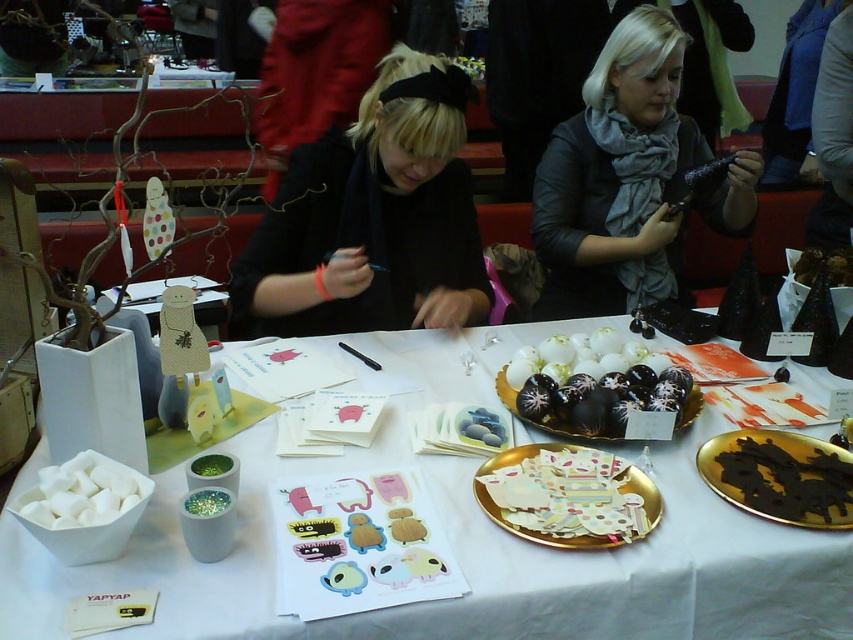
Which of these two, black matte scarf at upper center or shiny chocolate truffles at center, stands taller?

black matte scarf at upper center

Does point (473, 227) come farther from viewer compared to point (509, 404)?

Yes, it is.

Identify the location of black matte scarf at upper center. This screenshot has height=640, width=853. (372, 218).

This screenshot has width=853, height=640. What do you see at coordinates (372, 218) in the screenshot?
I see `black matte scarf at upper center` at bounding box center [372, 218].

Is point (322, 209) closer to camera compared to point (612, 60)?

That is True.

Does point (410, 106) come behind point (608, 264)?

No, (410, 106) is closer to viewer.

Where is `black matte scarf at upper center`? The height and width of the screenshot is (640, 853). black matte scarf at upper center is located at coordinates (372, 218).

Does paper cutouts at center appear on the right side of chocolate cake at center?

No, paper cutouts at center is not to the right of chocolate cake at center.

Who is positioned more to the left, paper cutouts at center or chocolate cake at center?

paper cutouts at center

Measure the distance between paper cutouts at center and camera.

paper cutouts at center and camera are 94.92 centimeters apart from each other.

This screenshot has height=640, width=853. What are the coordinates of `paper cutouts at center` in the screenshot? It's located at (567, 496).